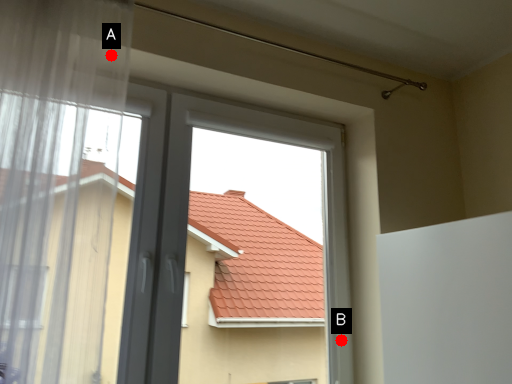
Question: Two points are circled on the image, labeled by A and B beside each circle. Which point is farther to the camera?

Choices:
 (A) A is further
 (B) B is further

Answer: (B)